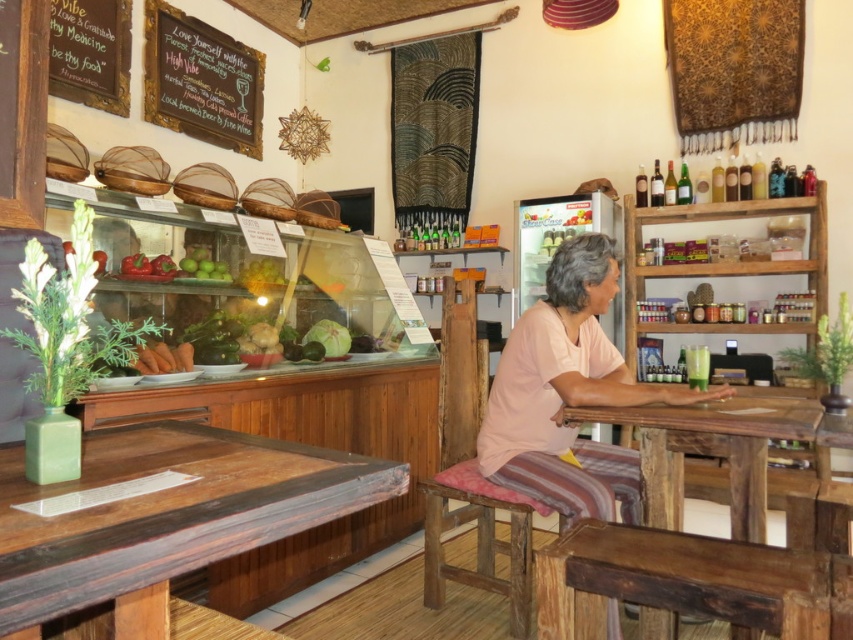
Question: Estimate the real-world distances between objects in this image. Which object is closer to the dark brown wood table at center?

Choices:
 (A) chalkboard sign at upper left
 (B) wooden chalkboard at upper left
 (C) rustic wood stool at center

Answer: (C)

Question: Considering the real-world distances, which object is closest to the chalkboard sign at upper left?

Choices:
 (A) dark brown wood table at center
 (B) wooden table at lower left

Answer: (B)

Question: Is wooden table at lower left below chalkboard sign at upper left?

Choices:
 (A) yes
 (B) no

Answer: (A)

Question: Does wooden chalkboard at upper left appear on the right side of rustic wood stool at center?

Choices:
 (A) no
 (B) yes

Answer: (A)

Question: Among these objects, which one is farthest from the camera?

Choices:
 (A) wooden chalkboard at upper left
 (B) wooden table at lower left

Answer: (A)

Question: From the image, what is the correct spatial relationship of wooden table at lower left in relation to wooden chalkboard at upper left?

Choices:
 (A) below
 (B) above

Answer: (A)